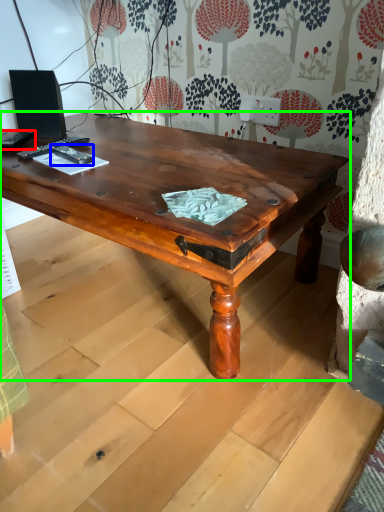
Question: Which is nearer to the remote control (highlighted by a red box)? remote control (highlighted by a blue box) or coffee table (highlighted by a green box).

Choices:
 (A) remote control
 (B) coffee table

Answer: (A)